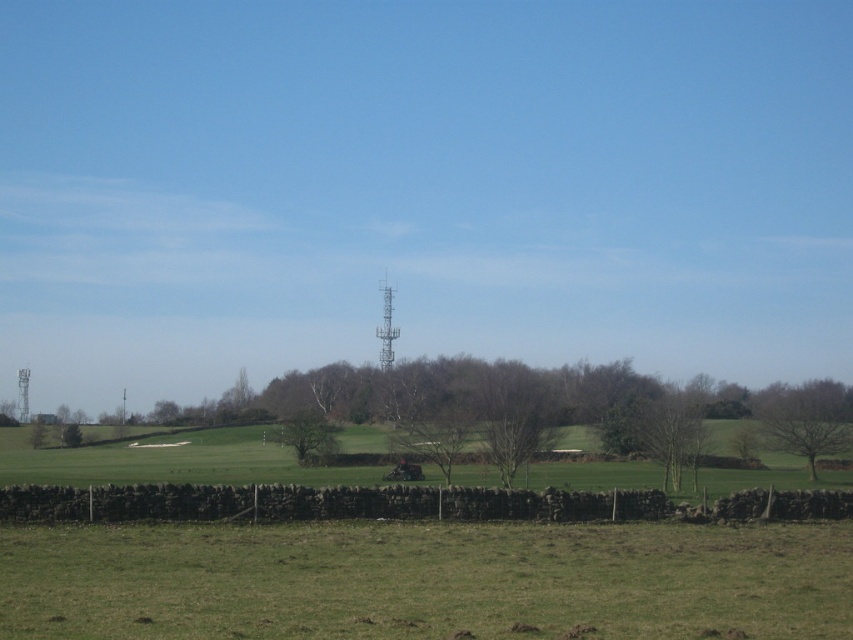
Question: Based on their relative distances, which object is farther from the bare branches at lower right?

Choices:
 (A) green leafy tree at lower left
 (B) green grass at lower center

Answer: (A)

Question: Which of the following is the farthest from the observer?

Choices:
 (A) (161, 636)
 (B) (77, 426)

Answer: (B)

Question: Is green leafy tree at center further to camera compared to green leafy tree at lower left?

Choices:
 (A) no
 (B) yes

Answer: (A)

Question: Can you confirm if green grass at lower center is thinner than green leafy tree at center?

Choices:
 (A) no
 (B) yes

Answer: (A)

Question: Is the position of green grass at lower center less distant than that of green leafy tree at lower left?

Choices:
 (A) no
 (B) yes

Answer: (B)

Question: Which is nearer to the green matte tree at lower right?

Choices:
 (A) green leafy tree at center
 (B) bare branches at lower right
 (C) green leafy tree at lower left
 (D) green grass at lower center

Answer: (B)